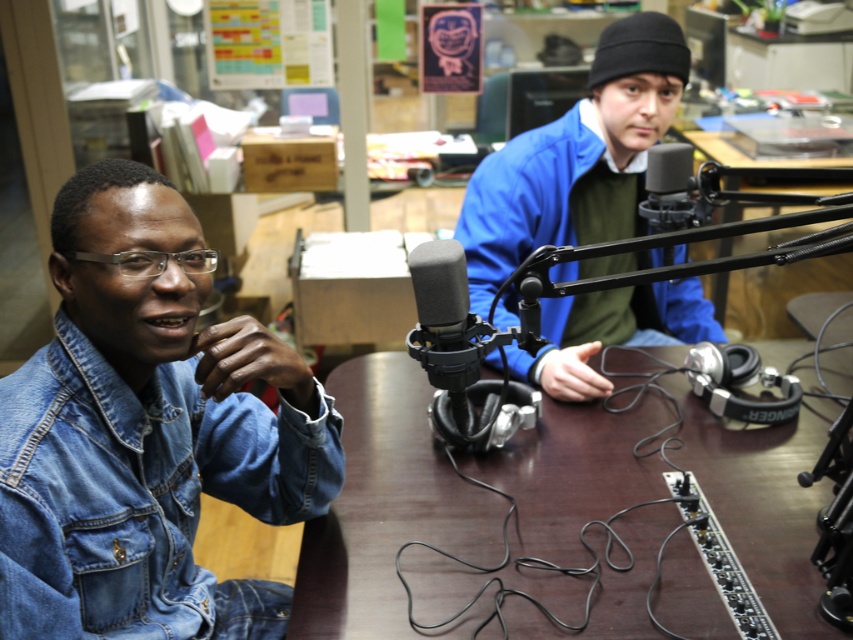
You are a sound engineer setting up the studio. You need to place a new microphone stand between the denim jacket at lower right and the blue denim jacket at center. Based on their positions, can you determine which jacket is closer to the edge of the table?

The denim jacket at lower right is located below the blue denim jacket at center, so the denim jacket at lower right is closer to the edge of the table.

You are a sound engineer setting up the studio. You need to place a new microphone stand to the left of the black matte microphone at center. Will the blue denim jacket at center interfere with the placement?

The blue denim jacket at center is positioned on the right side of the black matte microphone at center, so placing the microphone stand to the left of the black matte microphone at center would not interfere with the blue denim jacket at center.

You are a photographer standing in front of the radio studio setup. You want to take a closeup photo of the point at coordinates point (273,502) and point (595,52). Which point should you focus on first to ensure it appears sharp in the photo?

You should focus on point (273,502) first because it is closer to the camera than point (595,52), so it will be in focus before the other point.